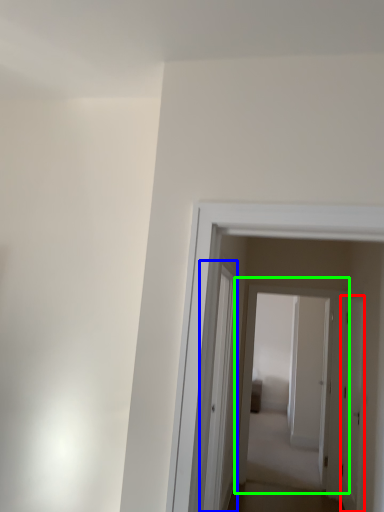
Question: Which object is positioned farthest from door (highlighted by a red box)? Select from glass door (highlighted by a blue box) and door (highlighted by a green box).

Choices:
 (A) glass door
 (B) door

Answer: (A)